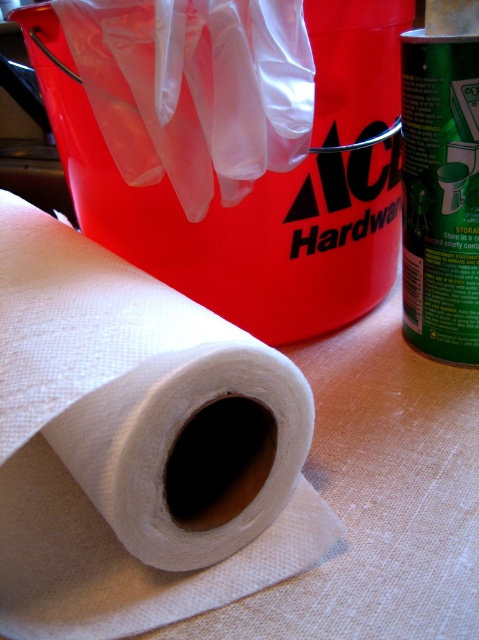
Question: Can you confirm if white textured paper towel at center is wider than white fabric roll at center?

Choices:
 (A) no
 (B) yes

Answer: (B)

Question: Which of the following is the farthest from the observer?

Choices:
 (A) white textured paper towel at center
 (B) white fabric roll at center

Answer: (B)

Question: Which point appears farthest from the camera in this image?

Choices:
 (A) (304, 51)
 (B) (123, 480)

Answer: (A)

Question: Does white textured paper towel at center come behind white fabric roll at center?

Choices:
 (A) yes
 (B) no

Answer: (B)

Question: Is white textured paper towel at center smaller than white fabric roll at center?

Choices:
 (A) yes
 (B) no

Answer: (B)